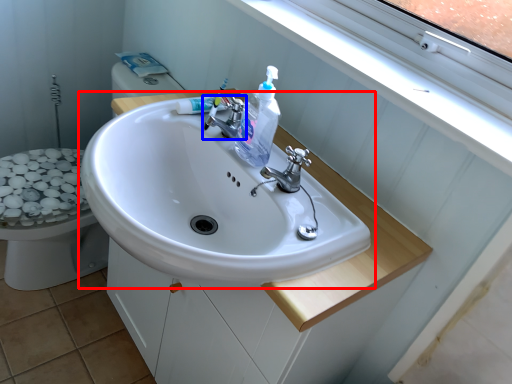
Question: Which point is further to the camera, sink (highlighted by a red box) or tap (highlighted by a blue box)?

Choices:
 (A) sink
 (B) tap

Answer: (B)